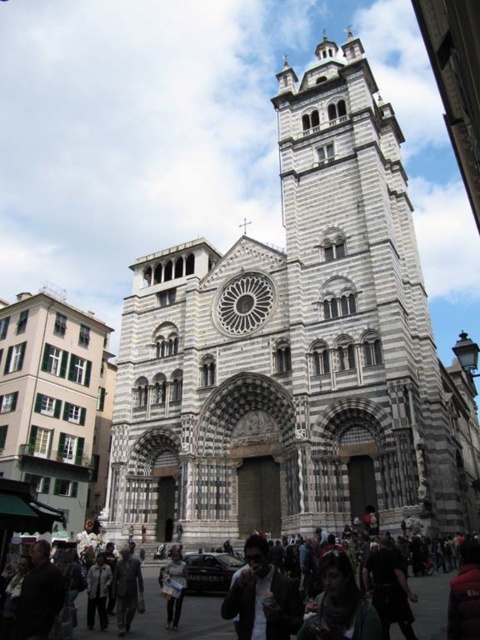
Question: Is gray stone tower at center above white cotton jacket at lower center?

Choices:
 (A) yes
 (B) no

Answer: (A)

Question: Does dark gray jacket at center appear on the left side of matte black jacket at center?

Choices:
 (A) no
 (B) yes

Answer: (B)

Question: Is dark red jacket at center wider than white cotton jacket at lower center?

Choices:
 (A) no
 (B) yes

Answer: (B)

Question: Which object is positioned farthest from the gray stone tower at center?

Choices:
 (A) dark gray jacket at center
 (B) white cotton jacket at lower center
 (C) dark red jacket at center
 (D) green fabric scarf at center

Answer: (D)

Question: Which point appears farthest from the camera in this image?

Choices:
 (A) (226, 618)
 (B) (420, 580)
 (C) (472, 545)

Answer: (B)

Question: Which point appears farthest from the camera in this image?

Choices:
 (A) (458, 563)
 (B) (345, 573)
 (C) (159, 608)
 (D) (182, 580)

Answer: (A)